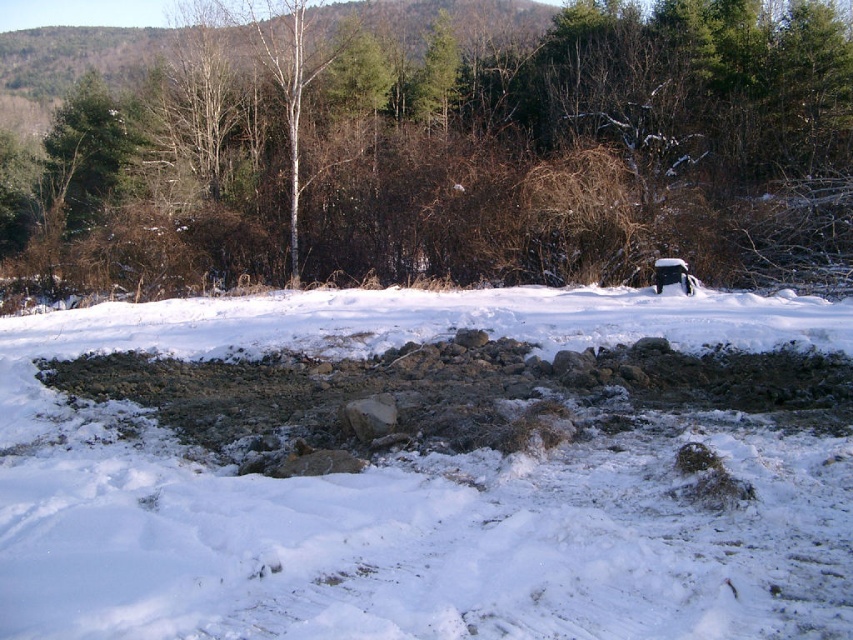
Question: Can you confirm if damp gray mud at center is positioned below green matte tree at upper left?

Choices:
 (A) yes
 (B) no

Answer: (A)

Question: Which object is positioned closest to the gray rough stone at center?

Choices:
 (A) green matte tree at upper left
 (B) white powdery snow at center
 (C) damp gray mud at center

Answer: (C)

Question: Does white powdery snow at center have a lesser width compared to gray rough stone at center?

Choices:
 (A) no
 (B) yes

Answer: (A)

Question: Considering the real-world distances, which object is farthest from the green matte tree at upper left?

Choices:
 (A) gray rough stone at center
 (B) brown bark tree at center
 (C) damp gray mud at center
 (D) white powdery snow at center

Answer: (A)

Question: Where is brown bark tree at center located in relation to gray rough stone at center in the image?

Choices:
 (A) above
 (B) below

Answer: (A)

Question: Which of the following is the farthest from the observer?

Choices:
 (A) (700, 330)
 (B) (312, 224)
 (C) (363, 406)
 (D) (795, 381)

Answer: (B)